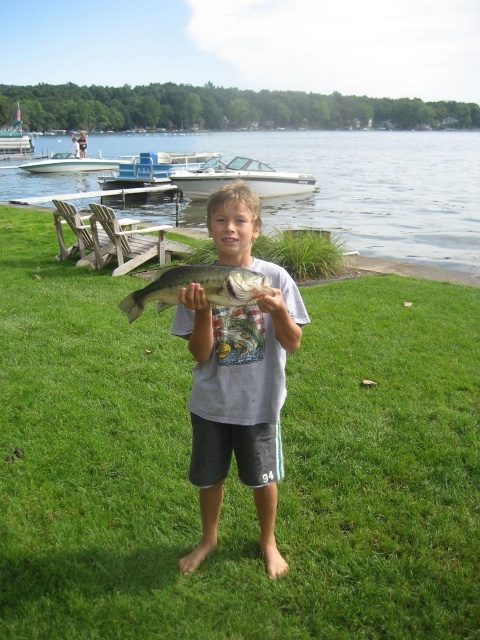
Question: Estimate the real-world distances between objects in this image. Which object is closer to the white glossy boat at center?

Choices:
 (A) blue plastic boat at center
 (B) white glossy boat at upper left
 (C) green shiny fish at center

Answer: (A)

Question: Among these points, which one is nearest to the camera?

Choices:
 (A) (309, 173)
 (B) (68, 156)
 (C) (264, 413)
 (D) (124, 301)

Answer: (D)

Question: In this image, where is white glossy boat at center located relative to blue plastic boat at center?

Choices:
 (A) right
 (B) left

Answer: (A)

Question: Which object is farther from the camera taking this photo?

Choices:
 (A) white glossy boat at center
 (B) clear water at lower center
 (C) blue plastic boat at center

Answer: (C)

Question: From the image, what is the correct spatial relationship of white glossy boat at center in relation to white glossy boat at upper left?

Choices:
 (A) right
 (B) left

Answer: (A)

Question: Is green shiny fish at center further to camera compared to white glossy boat at center?

Choices:
 (A) yes
 (B) no

Answer: (B)